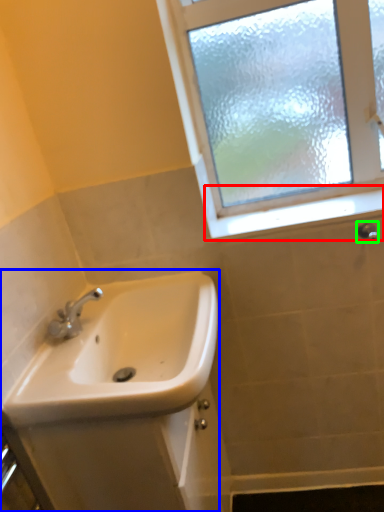
Question: Which object is the farthest from window sill (highlighted by a red box)? Choose among these: sink (highlighted by a blue box) or shower (highlighted by a green box).

Choices:
 (A) sink
 (B) shower

Answer: (A)